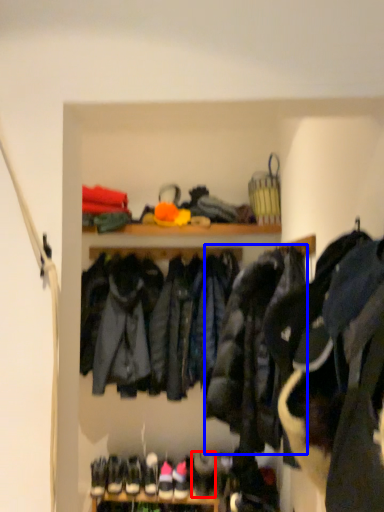
Question: Which of the following is the closest to the observer, shoe (highlighted by a red box) or jacket (highlighted by a blue box)?

Choices:
 (A) shoe
 (B) jacket

Answer: (B)